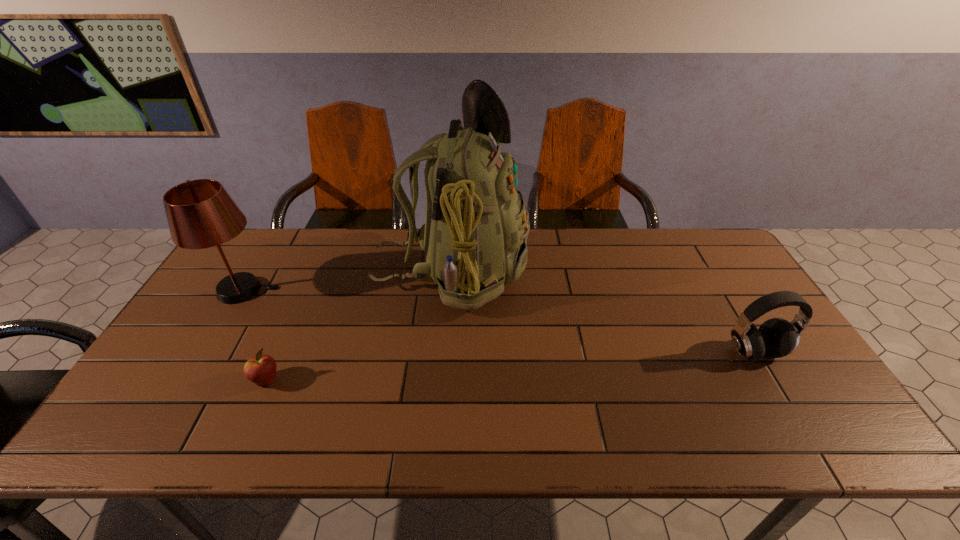
This screenshot has height=540, width=960. I want to click on vacant region located on the ear cups of the second shortest object, so point(789,410).

I want to click on free space located on the back of the apple, so click(x=278, y=353).

I want to click on backpack located in the far edge section of the desktop, so click(474, 238).

Where is `lampshade located in the far edge section of the desktop`? The height and width of the screenshot is (540, 960). lampshade located in the far edge section of the desktop is located at coordinates (201, 214).

Where is `object that is positioned at the left edge`? The width and height of the screenshot is (960, 540). object that is positioned at the left edge is located at coordinates click(201, 214).

Image resolution: width=960 pixels, height=540 pixels. What are the coordinates of `object that is at the right edge` in the screenshot? It's located at (776, 337).

What are the coordinates of `object positioned at the far left corner` in the screenshot? It's located at (201, 214).

Image resolution: width=960 pixels, height=540 pixels. I want to click on free region at the far edge, so click(x=394, y=239).

You are a GUI agent. You are given a task and a screenshot of the screen. Output one action in this format:
    pyautogui.click(x=<x>, y=<y>)
    Task: Click on the vacant region at the near edge of the desktop
    This screenshot has height=540, width=960.
    Given the screenshot: What is the action you would take?
    pyautogui.click(x=227, y=420)

In the image, there is a desktop. Identify the location of vacant space at the left edge. (206, 308).